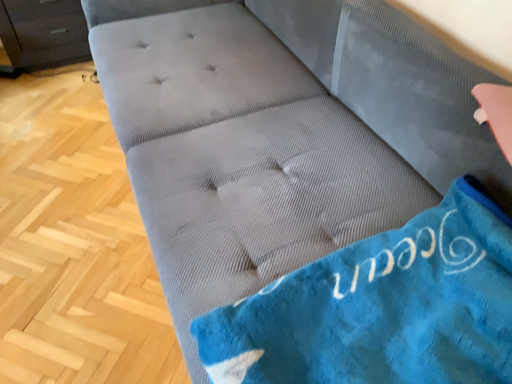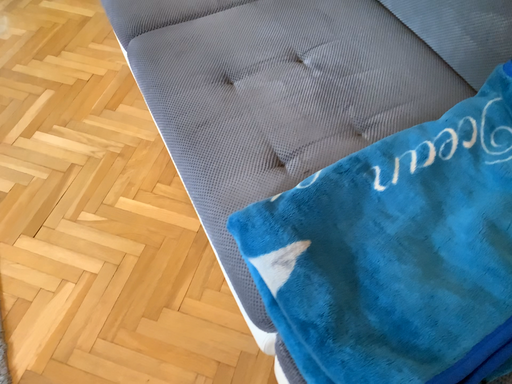
Question: Which way did the camera rotate in the video?

Choices:
 (A) rotated downward
 (B) rotated upward

Answer: (A)